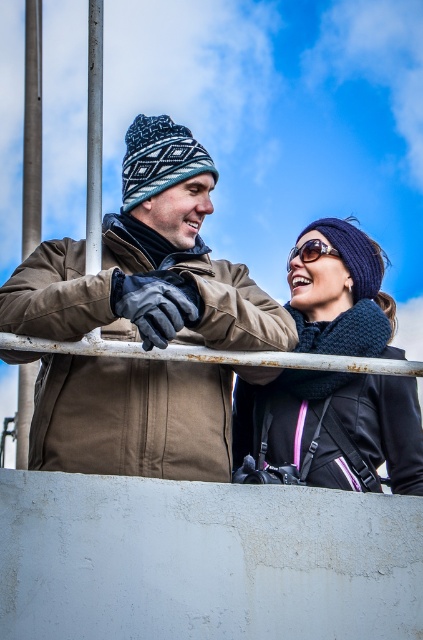
Question: Which point is farther from the camera taking this photo?

Choices:
 (A) (327, 252)
 (B) (90, 8)

Answer: (A)

Question: Is smooth silver pole at left positioned in front of sunglasses at center?

Choices:
 (A) yes
 (B) no

Answer: (B)

Question: Considering the relative positions of brown leather jacket at upper left and smooth silver pole at left in the image provided, where is brown leather jacket at upper left located with respect to smooth silver pole at left?

Choices:
 (A) above
 (B) below

Answer: (B)

Question: Can you confirm if brown leather jacket at upper left is smaller than smooth metal pole at upper left?

Choices:
 (A) yes
 (B) no

Answer: (A)

Question: Estimate the real-world distances between objects in this image. Which object is farther from the brown leather jacket at upper left?

Choices:
 (A) sunglasses at center
 (B) knitted dark blue scarf at upper right
 (C) smooth metal pole at upper left
 (D) smooth silver pole at left

Answer: (D)

Question: Estimate the real-world distances between objects in this image. Which object is closer to the smooth metal pole at upper left?

Choices:
 (A) smooth silver pole at left
 (B) knitted dark blue scarf at upper right

Answer: (B)